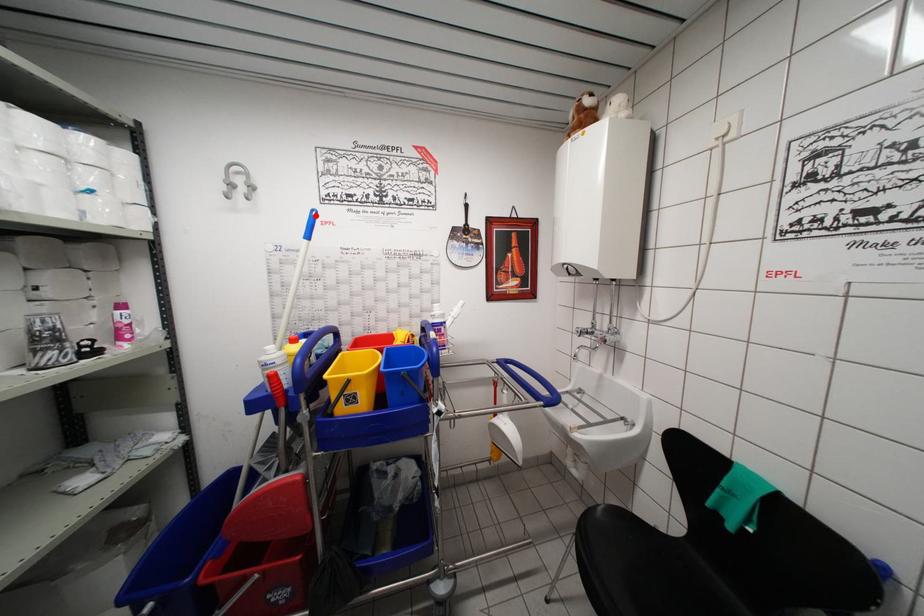
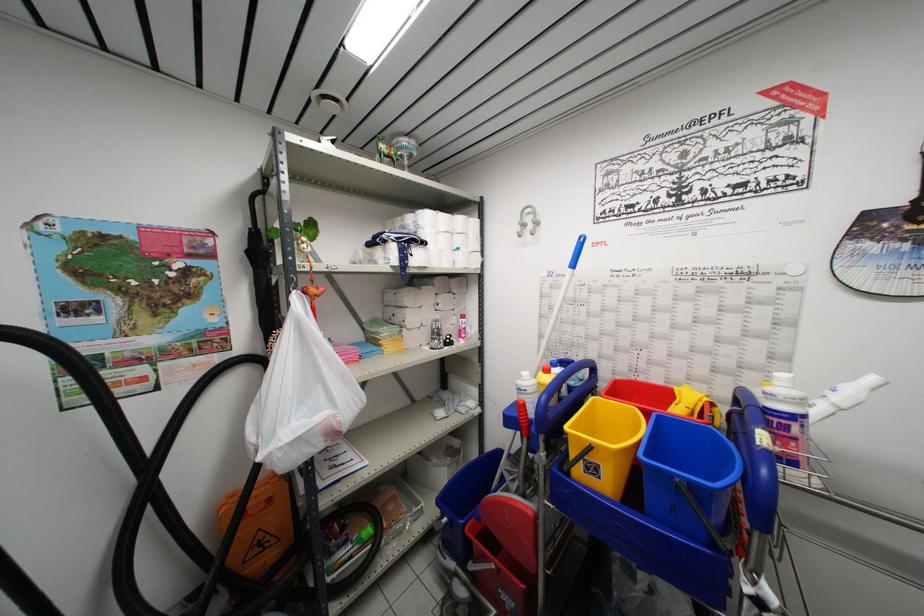
Find the pixel in the second image that matches the highlighted location in the first image.

(584, 241)